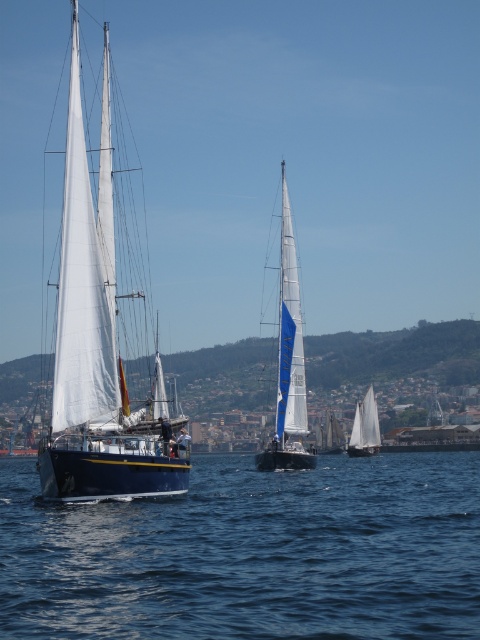
Question: Does blue water at lower left appear on the right side of white sailboat at center?

Choices:
 (A) no
 (B) yes

Answer: (A)

Question: Which point is farther from the camera taking this photo?

Choices:
 (A) (295, 355)
 (B) (362, 444)
 (C) (420, 472)
 (D) (92, 413)

Answer: (B)

Question: Can you confirm if white matte sailboat at center is smaller than white sailboat at center?

Choices:
 (A) yes
 (B) no

Answer: (B)

Question: Which is nearer to the white sailboat at center?

Choices:
 (A) white matte sailboat at left
 (B) blue water at lower left
 (C) white matte sailboat at center

Answer: (B)

Question: Estimate the real-world distances between objects in this image. Which object is farther from the blue water at lower left?

Choices:
 (A) white matte sailboat at center
 (B) white matte sailboat at left

Answer: (B)

Question: Is white matte sailboat at left above white sailboat at center?

Choices:
 (A) no
 (B) yes

Answer: (B)